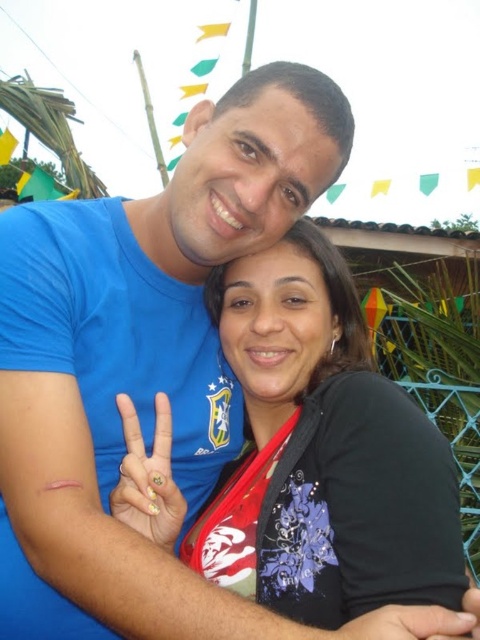
You are a photographer setting up for a closeup shot of the hands in the image. The gold glitter nail polish at center and the smooth skin hand at center are in your frame. To ensure the nail polish is clearly visible, where should you focus your camera?

The gold glitter nail polish at center is above the smooth skin hand at center, so focusing on the gold glitter nail polish at center will ensure it is clearly visible.

You are a photographer setting up for a portrait shoot. You notice the matte black shirt at center and the gold glitter nail polish at center in the frame. Which object should you adjust your focus to ensure it appears sharp in the final image if you want to prioritize the one closer to the camera?

The gold glitter nail polish at center is closer to the camera than the matte black shirt at center, so focusing on it will ensure it appears sharp while the matte black shirt at center may appear slightly out of focus due to depth of field limitations.